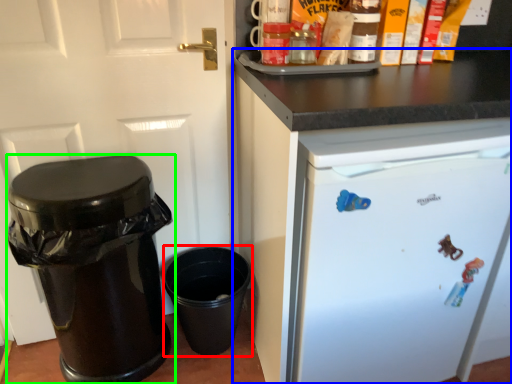
Question: Based on their relative distances, which object is farther from crock pot (highlighted by a red box)? Choose from cabinetry (highlighted by a blue box) and waste container (highlighted by a green box).

Choices:
 (A) cabinetry
 (B) waste container

Answer: (A)